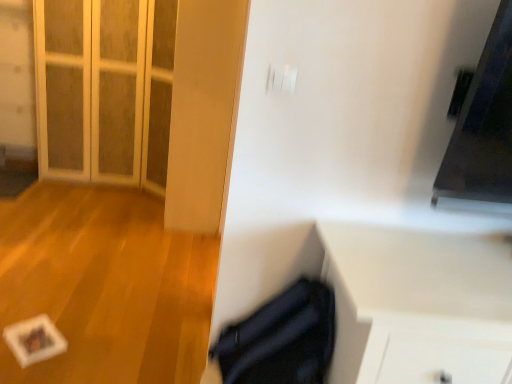
Question: Based on their sizes in the image, would you say white matte cabinet at lower right is bigger or smaller than white matte paper at lower left?

Choices:
 (A) small
 (B) big

Answer: (A)

Question: Is point coord(398,367) positioned closer to the camera than point coord(80,336)?

Choices:
 (A) closer
 (B) farther

Answer: (A)

Question: Which object is the farthest from the white matte cabinet at lower right?

Choices:
 (A) white matte paper at lower left
 (B) white glass door at upper left

Answer: (B)

Question: Estimate the real-world distances between objects in this image. Which object is farther from the white glass door at upper left?

Choices:
 (A) white matte cabinet at lower right
 (B) white matte paper at lower left

Answer: (A)